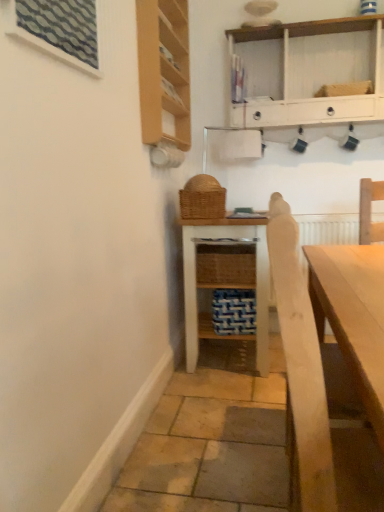
Question: From the image's perspective, is textured glass window at upper left beneath light wood cabinet at upper left?

Choices:
 (A) no
 (B) yes

Answer: (B)

Question: Does textured glass window at upper left have a lesser height compared to light wood cabinet at upper left?

Choices:
 (A) yes
 (B) no

Answer: (A)

Question: From a real-world perspective, is textured glass window at upper left positioned over light wood cabinet at upper left based on gravity?

Choices:
 (A) no
 (B) yes

Answer: (A)

Question: Is light wood cabinet at upper left inside textured glass window at upper left?

Choices:
 (A) no
 (B) yes

Answer: (A)

Question: Can you confirm if textured glass window at upper left is positioned to the left of light wood cabinet at upper left?

Choices:
 (A) yes
 (B) no

Answer: (A)

Question: From a real-world perspective, is textured glass window at upper left under light wood cabinet at upper left?

Choices:
 (A) no
 (B) yes

Answer: (B)

Question: Is textured glass window at upper left far away from light brown wooden armchair at right?

Choices:
 (A) yes
 (B) no

Answer: (B)

Question: Is textured glass window at upper left closer to camera compared to light brown wooden armchair at right?

Choices:
 (A) yes
 (B) no

Answer: (B)

Question: Can you confirm if textured glass window at upper left is positioned to the right of light brown wooden armchair at right?

Choices:
 (A) no
 (B) yes

Answer: (A)

Question: From a real-world perspective, does textured glass window at upper left sit lower than light brown wooden armchair at right?

Choices:
 (A) no
 (B) yes

Answer: (A)

Question: Does textured glass window at upper left have a lesser width compared to light brown wooden armchair at right?

Choices:
 (A) yes
 (B) no

Answer: (A)

Question: Considering the relative positions of textured glass window at upper left and light brown wooden armchair at right in the image provided, is textured glass window at upper left to the left of light brown wooden armchair at right from the viewer's perspective?

Choices:
 (A) yes
 (B) no

Answer: (A)

Question: From the image's perspective, does textured glass window at upper left appear higher than white painted wood shelf at upper center, arranged as the first shelf when viewed from the top?

Choices:
 (A) yes
 (B) no

Answer: (B)